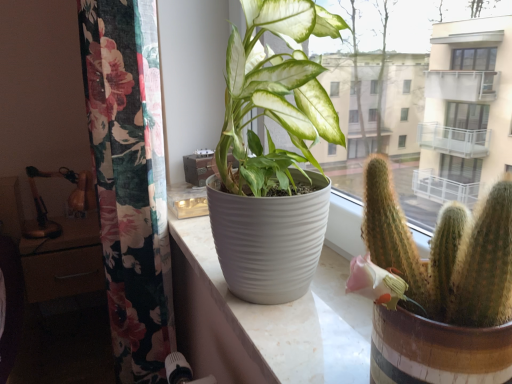
Locate an element on the screen. free space above matte brown drawer at left (from a real-world perspective) is located at coordinates (54, 228).